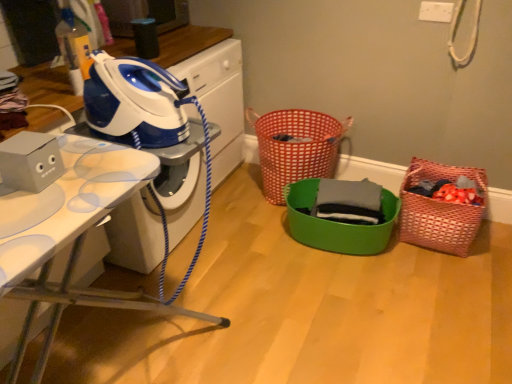
Where is `free space to the right of white glossy ironing board at left`? free space to the right of white glossy ironing board at left is located at coordinates (244, 245).